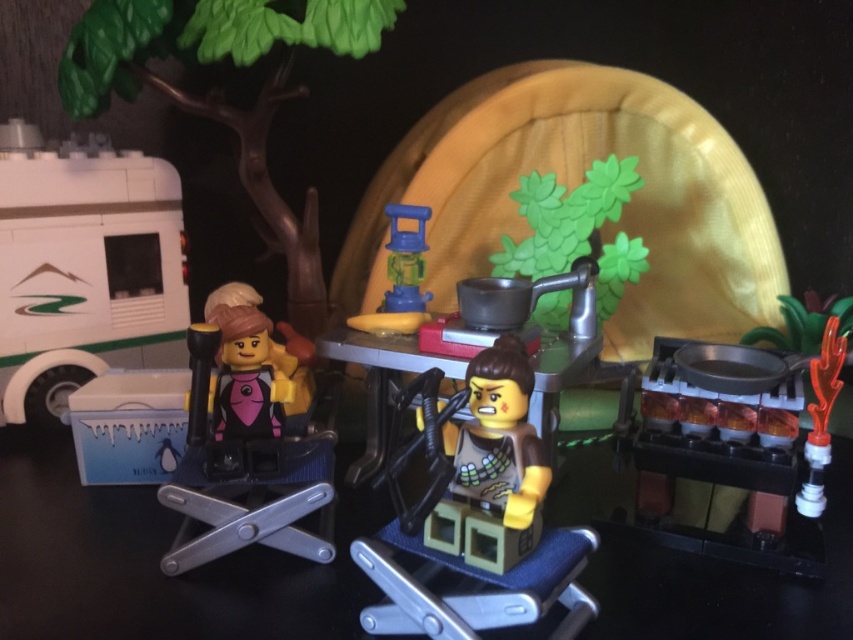
Who is positioned more to the left, white plastic recreational vehicle at left or translucent orange plastic at right?

white plastic recreational vehicle at left is more to the left.

Is white plastic recreational vehicle at left positioned at the back of translucent orange plastic at right?

Yes.

Is point (21, 154) closer to viewer compared to point (822, 422)?

No, (21, 154) is further to viewer.

You are a GUI agent. You are given a task and a screenshot of the screen. Output one action in this format:
    pyautogui.click(x=<x>, y=<y>)
    Task: Click on the white plastic recreational vehicle at left
    The height and width of the screenshot is (640, 853).
    Given the screenshot: What is the action you would take?
    pyautogui.click(x=83, y=269)

Can you confirm if matte black minifigure at center is positioned to the right of translucent orange plastic at right?

No, matte black minifigure at center is not to the right of translucent orange plastic at right.

Which is in front, point (190, 449) or point (834, 339)?

Point (834, 339) is in front.

In order to click on matte black minifigure at center in this screenshot , I will do `click(252, 448)`.

Describe the element at coordinates (492, 465) in the screenshot. The width and height of the screenshot is (853, 640). I see `matte brown minifigure at center` at that location.

Which is below, matte brown minifigure at center or smooth wooden table at center?

matte brown minifigure at center

In the scene shown: Who is more forward, (483, 531) or (563, 378)?

Positioned in front is point (483, 531).

Identify the location of matte brown minifigure at center. The image size is (853, 640). (492, 465).